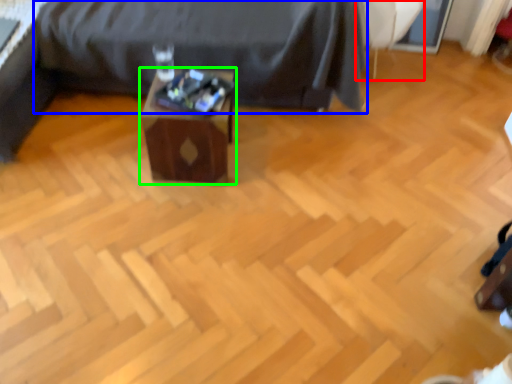
Question: Which object is the farthest from swivel chair (highlighted by a red box)? Choose among these: furniture (highlighted by a blue box) or table (highlighted by a green box).

Choices:
 (A) furniture
 (B) table

Answer: (B)